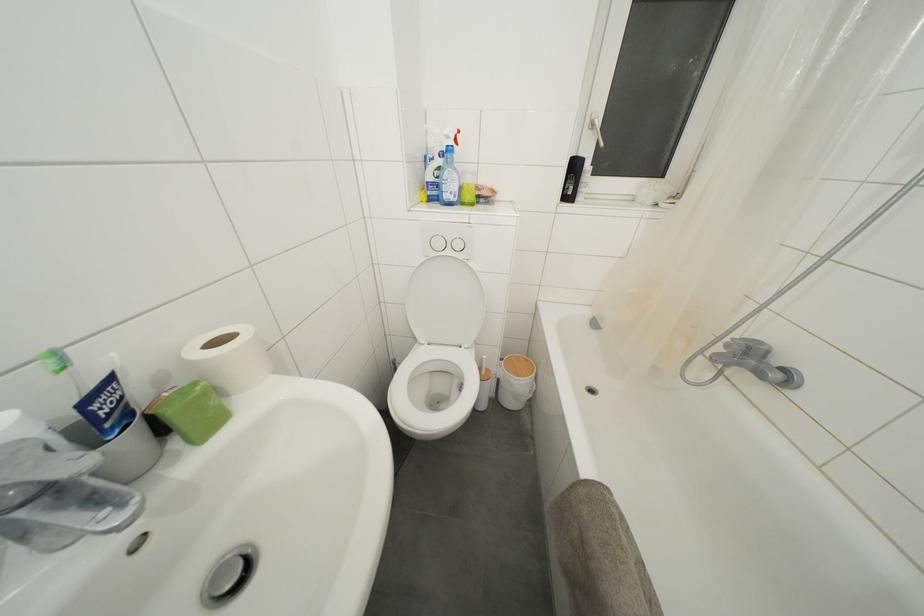
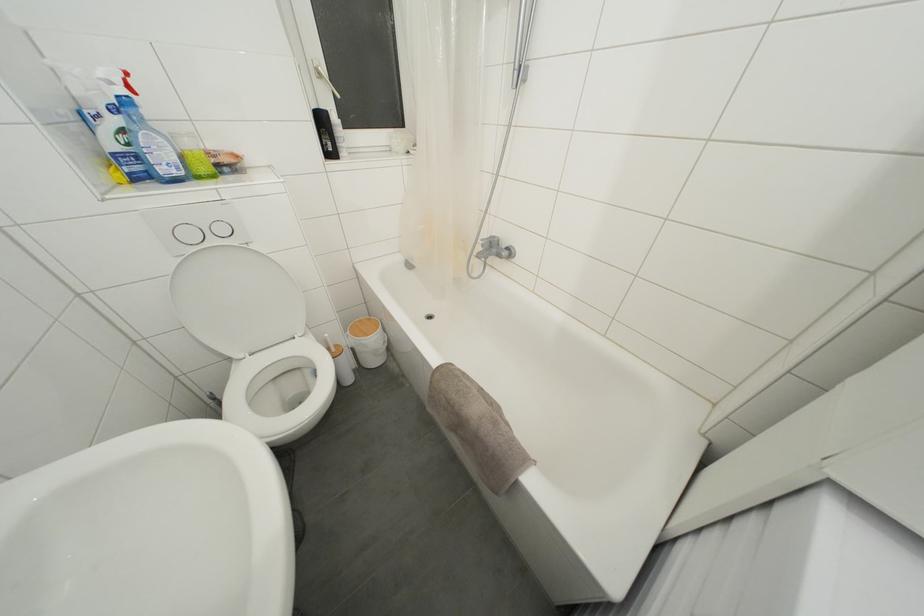
Where in the second image is the point corresponding to point (489, 362) from the first image?

(331, 339)